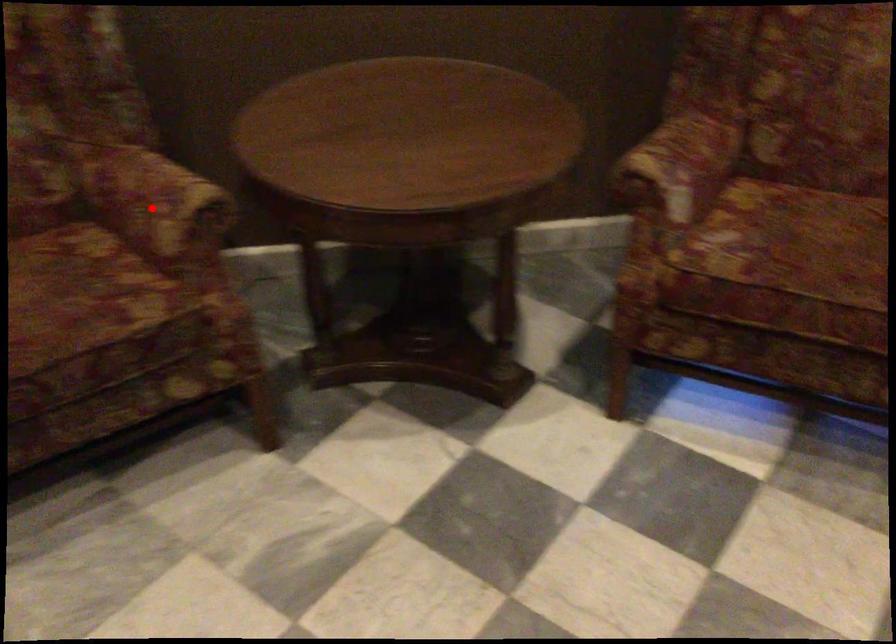
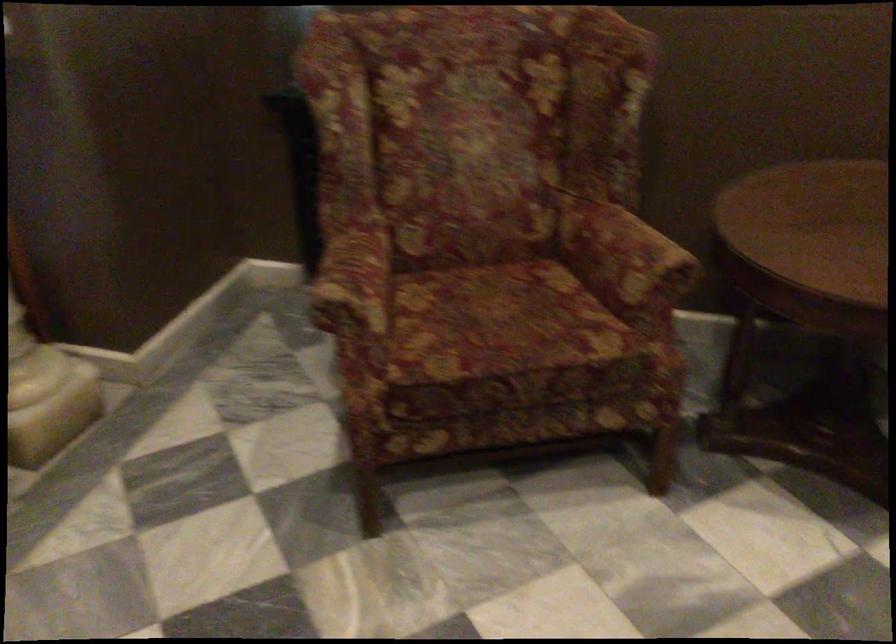
Question: I am providing you with two images of the same scene from different viewpoints. A red point is marked on the first image. Is the red point's position out of view in image 2?

Choices:
 (A) Yes
 (B) No

Answer: (B)